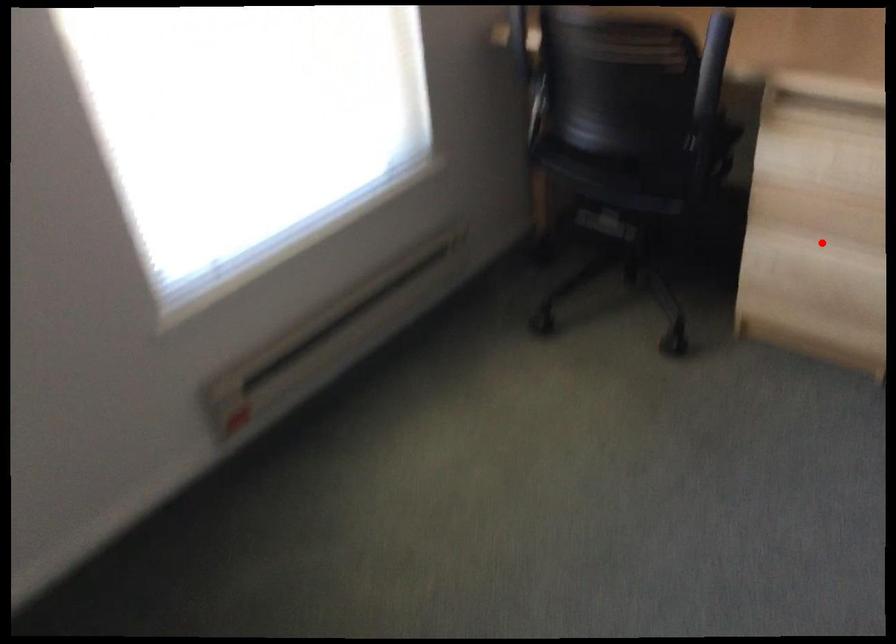
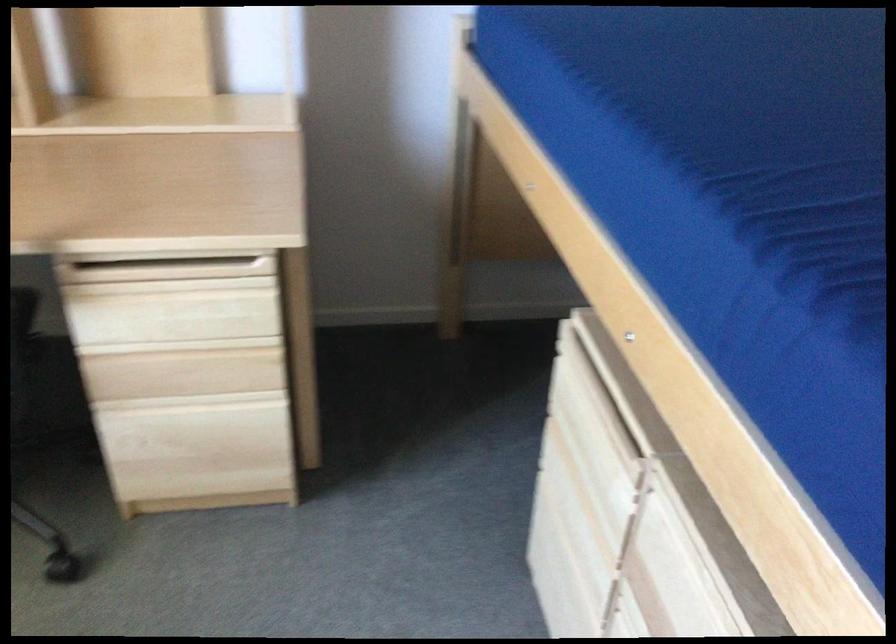
Question: I am providing you with two images of the same scene from different viewpoints. A red point is marked on the first image. Can you still see the location of the red point in image 2?

Choices:
 (A) Yes
 (B) No

Answer: (A)